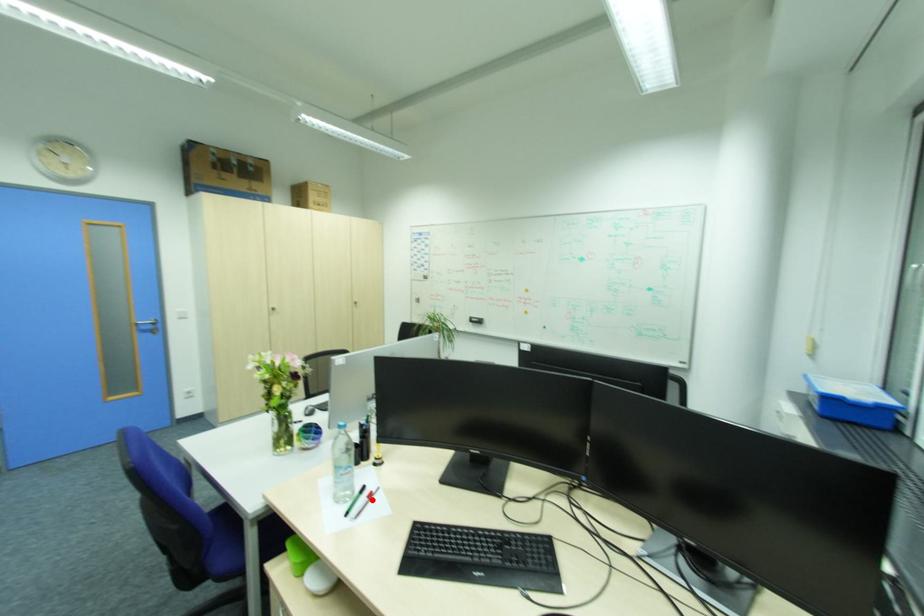
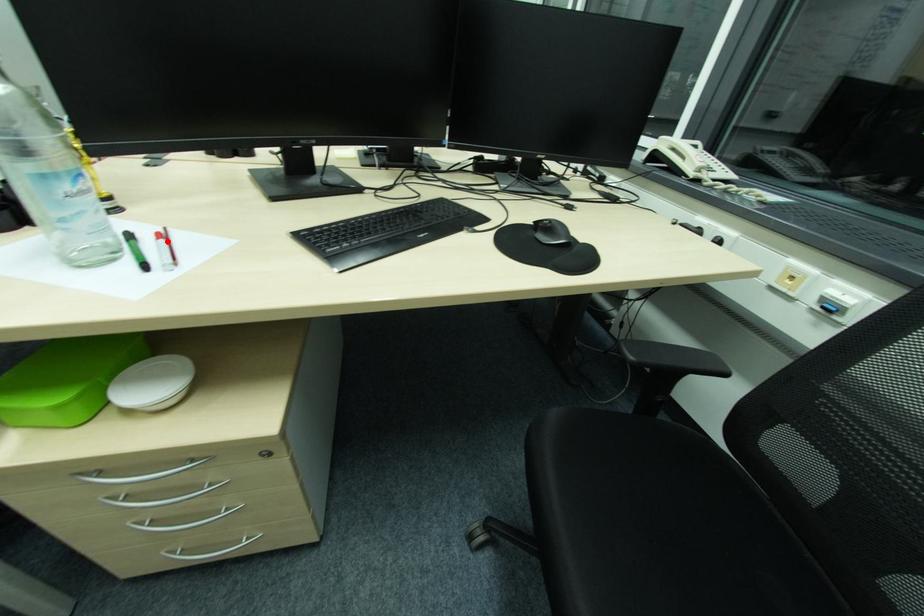
I am providing you with two images of the same scene from different viewpoints. A red point is marked on the first image and another point is marked on the second image. Is the marked point in image1 the same physical position as the marked point in image2?

Yes